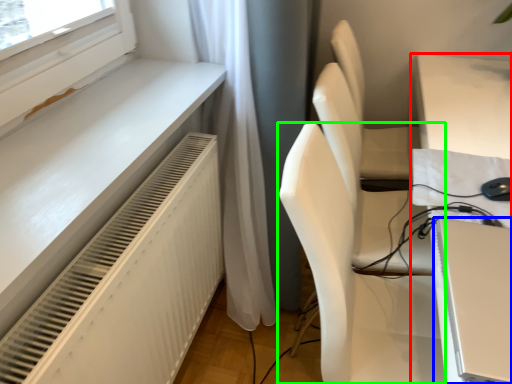
Question: Estimate the real-world distances between objects in this image. Which object is farther from table (highlighted by a red box), computer (highlighted by a blue box) or chair (highlighted by a green box)?

Choices:
 (A) computer
 (B) chair

Answer: (A)